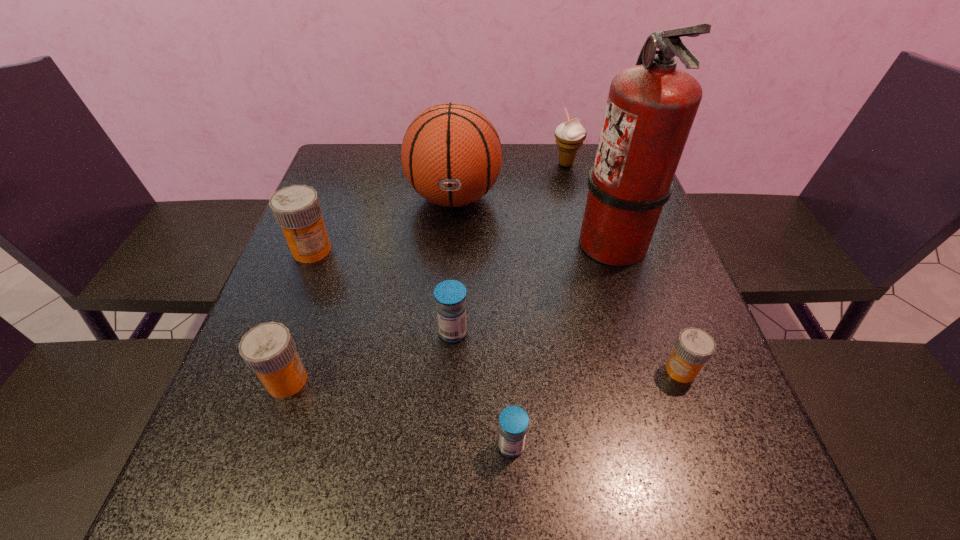
At what (x,y) coordinates should I click in order to perform the action: click on free point between the second smallest orange medicine and the second tallest object. Please return your answer as a coordinate pair (x, y). The height and width of the screenshot is (540, 960). Looking at the image, I should click on (371, 289).

Find the location of a particular element. vacant space that's between the icecream and the seventh shortest object is located at coordinates (510, 181).

At what (x,y) coordinates should I click in order to perform the action: click on free space between the second medicine from right to left and the red fire extinguisher. Please return your answer as a coordinate pair (x, y). Looking at the image, I should click on (562, 343).

You are a GUI agent. You are given a task and a screenshot of the screen. Output one action in this format:
    pyautogui.click(x=<x>, y=<y>)
    Task: Click on the free area in between the rightmost orange medicine and the seventh shortest object
    The width and height of the screenshot is (960, 540).
    Given the screenshot: What is the action you would take?
    pyautogui.click(x=567, y=284)

This screenshot has width=960, height=540. What are the coordinates of `vacant area that lies between the second tallest object and the fire extinguisher` in the screenshot? It's located at (533, 220).

Image resolution: width=960 pixels, height=540 pixels. Find the location of `object that stands as the second closest to the farthest orange medicine`. object that stands as the second closest to the farthest orange medicine is located at coordinates pos(269,350).

The height and width of the screenshot is (540, 960). Find the location of `object that is the second closest to the nearest medicine`. object that is the second closest to the nearest medicine is located at coordinates (x=694, y=347).

Locate which medicine is the second closest to the second smallest orange medicine. Please provide its 2D coordinates. Your answer should be formatted as a tuple, i.e. [(x, y)], where the tuple contains the x and y coordinates of a point satisfying the conditions above.

[(297, 210)]

Identify the location of medicine that is the closest to the bigger blue medicine. This screenshot has width=960, height=540. (514, 420).

Find the location of `orange medicine that is the third closest one to the third medicine from left to right`. orange medicine that is the third closest one to the third medicine from left to right is located at coordinates (694, 347).